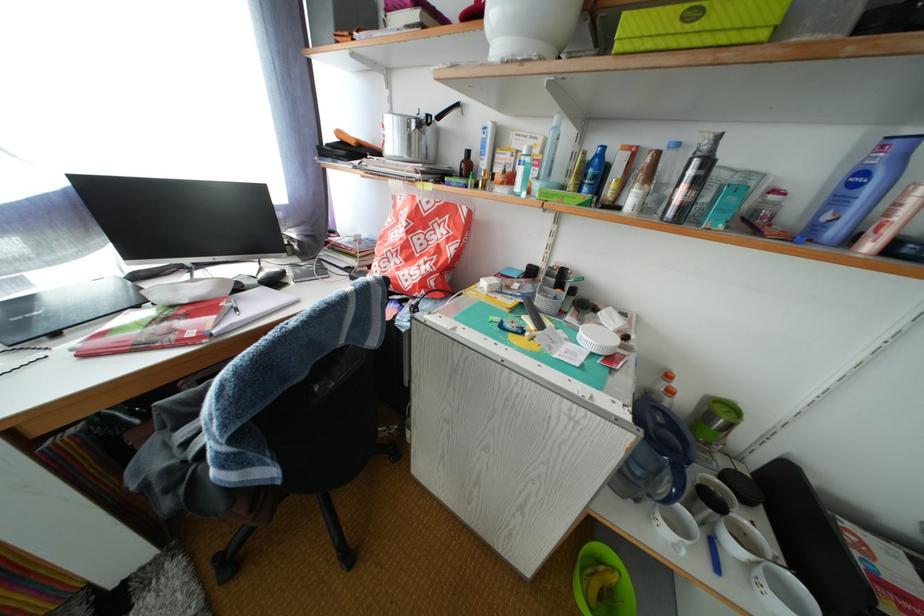
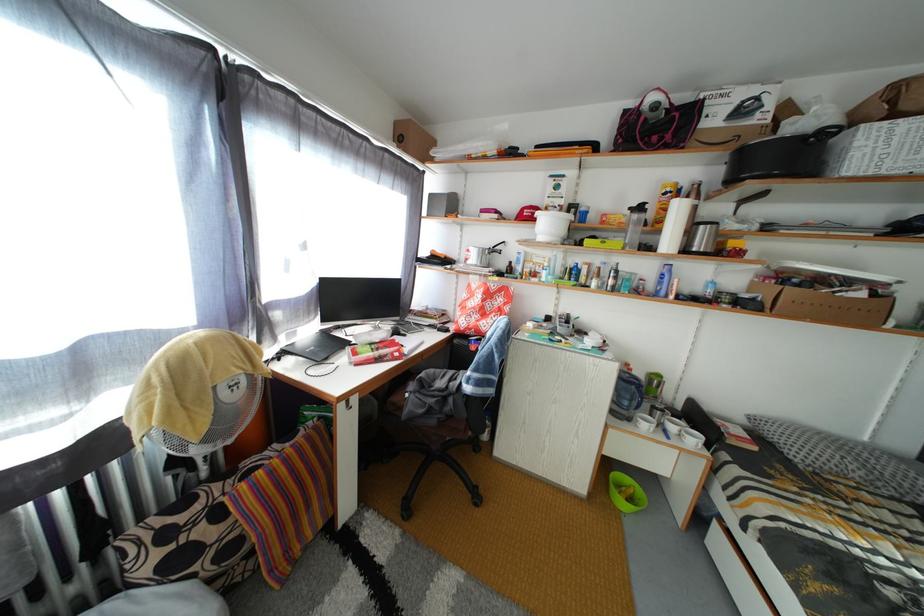
Based on the photo, in a continuous first-person perspective shot, in which direction is the camera moving?

The cameraman walked toward left, backward.